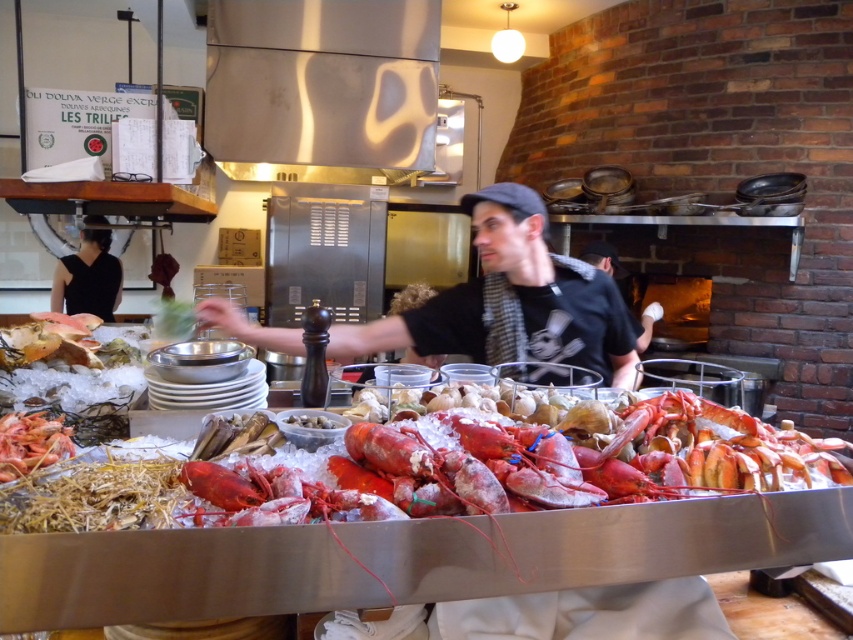
This screenshot has height=640, width=853. I want to click on shiny red lobster at center, so click(401, 560).

Between point (647, 534) and point (436, 332), which one is positioned behind?

The point (436, 332) is behind.

Between point (125, 545) and point (448, 307), which one is positioned behind?

The point (448, 307) is more distant.

Where is `shiny red lobster at center`? shiny red lobster at center is located at coordinates (401, 560).

Can you confirm if matte black shirt at center is positioned above white matte shell at center?

Correct, matte black shirt at center is located above white matte shell at center.

Between matte black shirt at center and white matte shell at center, which one is positioned lower?

white matte shell at center is below.

Between point (582, 362) and point (293, 416), which one is positioned in front?

Point (293, 416)

Image resolution: width=853 pixels, height=640 pixels. Find the location of `matte black shirt at center`. matte black shirt at center is located at coordinates (511, 301).

Which is in front, point (109, 259) or point (316, 417)?

Point (316, 417) is more forward.

Is black matte shirt at upper left to the left of white matte shell at center from the viewer's perspective?

Correct, you'll find black matte shirt at upper left to the left of white matte shell at center.

Is point (56, 272) farther from camera compared to point (293, 413)?

Yes.

You are a GUI agent. You are given a task and a screenshot of the screen. Output one action in this format:
    pyautogui.click(x=<x>, y=<y>)
    Task: Click on the black matte shirt at upper left
    This screenshot has width=853, height=640.
    Given the screenshot: What is the action you would take?
    pyautogui.click(x=88, y=276)